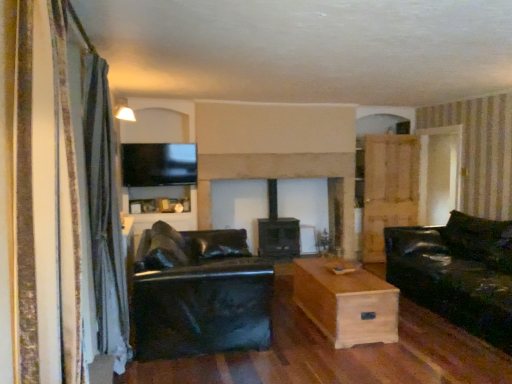
This screenshot has height=384, width=512. Identify the location of gray fabric curtain at left, which is counted as the 1th curtain, starting from the left. (104, 214).

In order to face light brown wood coffee table at center, should I rotate leftwards or rightwards?

It's best to rotate right around 10.959 degrees.

What is the approximate height of light brown wood coffee table at center?

It is 18.27 inches.

I want to click on light brown wood armoire at right, so click(388, 189).

Locate an element on the screen. The image size is (512, 384). gray fabric curtain at left, the 2th curtain positioned from the front is located at coordinates (104, 214).

In the scene shown: How many degrees apart are the facing directions of matte black tv at upper left and black leather couch at right, marked as the 1th studio couch in a right-to-left arrangement?

matte black tv at upper left and black leather couch at right, marked as the 1th studio couch in a right-to-left arrangement, are facing 91.7 degrees away from each other.

Who is smaller, matte black tv at upper left or black leather couch at right, marked as the 1th studio couch in a right-to-left arrangement?

With smaller size is matte black tv at upper left.

From a real-world perspective, is matte black tv at upper left positioned above or below black leather couch at right, marked as the 2th studio couch in a left-to-right arrangement?

matte black tv at upper left is above black leather couch at right, marked as the 2th studio couch in a left-to-right arrangement.

Find the location of a particular element. the 1st studio couch below the matte black tv at upper left (from the image's perspective) is located at coordinates (457, 272).

Considering the points (176, 186) and (99, 236), which point is in front, point (176, 186) or point (99, 236)?

Point (99, 236)

From a real-world perspective, is matte black tv at upper left under gray fabric curtain at left, which appears as the second curtain when viewed from the right?

No, from a real-world perspective, matte black tv at upper left is not beneath gray fabric curtain at left, which appears as the second curtain when viewed from the right.

In the image, is matte black tv at upper left positioned in front of or behind gray fabric curtain at left, the 2th curtain positioned from the front?

matte black tv at upper left is positioned farther from the viewer than gray fabric curtain at left, the 2th curtain positioned from the front.

Which of these two, black leather couch at right, marked as the 2th studio couch in a left-to-right arrangement, or light brown wood coffee table at center, is smaller?

light brown wood coffee table at center is smaller.

Based on the photo, considering the sizes of objects black leather couch at right, marked as the 1th studio couch in a right-to-left arrangement, and light brown wood coffee table at center in the image provided, who is taller, black leather couch at right, marked as the 1th studio couch in a right-to-left arrangement, or light brown wood coffee table at center?

black leather couch at right, marked as the 1th studio couch in a right-to-left arrangement.

From a real-world perspective, does black leather couch at right, marked as the 2th studio couch in a left-to-right arrangement, stand above light brown wood coffee table at center?

Yes, from a real-world perspective, black leather couch at right, marked as the 2th studio couch in a left-to-right arrangement, is on top of light brown wood coffee table at center.

Where is `table below the black leather couch at right, marked as the 1th studio couch in a right-to-left arrangement (from a real-world perspective)`? table below the black leather couch at right, marked as the 1th studio couch in a right-to-left arrangement (from a real-world perspective) is located at coordinates (346, 303).

Considering the points (97, 179) and (481, 273), which point is behind, point (97, 179) or point (481, 273)?

The point (481, 273) is behind.

Is gray fabric curtain at left, the first curtain viewed from the back, facing towards black leather couch at right, marked as the 2th studio couch in a left-to-right arrangement?

Yes.

Is gray fabric curtain at left, which appears as the second curtain when viewed from the right, completely or partially outside of black leather couch at right, marked as the 2th studio couch in a left-to-right arrangement?

Yes, gray fabric curtain at left, which appears as the second curtain when viewed from the right, is located beyond the bounds of black leather couch at right, marked as the 2th studio couch in a left-to-right arrangement.

How many degrees apart are the facing directions of gray fabric curtain at left, which appears as the second curtain when viewed from the right, and black leather couch at right, marked as the 1th studio couch in a right-to-left arrangement?

179 degrees separate the facing orientations of gray fabric curtain at left, which appears as the second curtain when viewed from the right, and black leather couch at right, marked as the 1th studio couch in a right-to-left arrangement.

Is light brown wood armoire at right oriented away from black leather couch at center, acting as the 2th studio couch starting from the right?

light brown wood armoire at right is not turned away from black leather couch at center, acting as the 2th studio couch starting from the right.

In terms of width, does light brown wood armoire at right look wider or thinner when compared to black leather couch at center, acting as the 2th studio couch starting from the right?

In the image, light brown wood armoire at right appears to be more narrow than black leather couch at center, acting as the 2th studio couch starting from the right.

Can you confirm if light brown wood armoire at right is bigger than black leather couch at center, acting as the 2th studio couch starting from the right?

No.

Which of these two, light brown wood armoire at right or black leather couch at center, acting as the 2th studio couch starting from the right, stands taller?

light brown wood armoire at right is taller.

Relative to light brown wood armoire at right, is striped fabric curtain at left, positioned as the first curtain in right-to-left order, in front or behind?

striped fabric curtain at left, positioned as the first curtain in right-to-left order, is positioned closer to the viewer than light brown wood armoire at right.

From the image's perspective, is striped fabric curtain at left, positioned as the first curtain in right-to-left order, located above or below light brown wood armoire at right?

Clearly, from the image's perspective, striped fabric curtain at left, positioned as the first curtain in right-to-left order, is above light brown wood armoire at right.

This screenshot has height=384, width=512. What are the coordinates of `the 2nd curtain located above the light brown wood armoire at right (from a real-world perspective)` in the screenshot? It's located at (41, 195).

From a real-world perspective, is striped fabric curtain at left, positioned as the first curtain in right-to-left order, located higher than light brown wood armoire at right?

Yes.

From a real-world perspective, which is physically above, transparent glass door at upper right or light brown wood armoire at right?

In real-world perspective, transparent glass door at upper right is above.

Which is less distant, (458, 136) or (364, 198)?

Point (458, 136) appears to be closer to the viewer than point (364, 198).

Can you confirm if transparent glass door at upper right is bigger than light brown wood armoire at right?

Correct, transparent glass door at upper right is larger in size than light brown wood armoire at right.

The width and height of the screenshot is (512, 384). Find the location of `entertainment center above the black leather couch at right, marked as the 1th studio couch in a right-to-left arrangement (from a real-world perspective)`. entertainment center above the black leather couch at right, marked as the 1th studio couch in a right-to-left arrangement (from a real-world perspective) is located at coordinates (157, 174).

From the image's perspective, starting from the matte black tv at upper left, which curtain is the 2nd one below? Please provide its 2D coordinates.

[(104, 214)]

Based on their spatial positions, is light brown wood coffee table at center or transparent glass door at upper right closer to black leather couch at right, marked as the 2th studio couch in a left-to-right arrangement?

Based on the image, light brown wood coffee table at center appears to be nearer to black leather couch at right, marked as the 2th studio couch in a left-to-right arrangement.

Looking at the image, which one is located further to transparent glass door at upper right, matte black tv at upper left or black leather couch at right, marked as the 2th studio couch in a left-to-right arrangement?

Among the two, matte black tv at upper left is located further to transparent glass door at upper right.

From the image, which object appears to be nearer to light brown wood coffee table at center, transparent glass door at upper right or striped fabric curtain at left, which ranks as the second curtain in back-to-front order?

transparent glass door at upper right is closer to light brown wood coffee table at center.

Which object lies further to the anchor point black leather couch at center, acting as the 2th studio couch starting from the right, light brown wood coffee table at center or light brown wood armoire at right?

light brown wood armoire at right lies further to black leather couch at center, acting as the 2th studio couch starting from the right, than the other object.

Based on the photo, looking at the image, which one is located closer to matte black tv at upper left, light brown wood armoire at right or striped fabric curtain at left, which ranks as the second curtain in back-to-front order?

Among the two, light brown wood armoire at right is located nearer to matte black tv at upper left.

In the scene shown: From the image, which object appears to be farther from light brown wood coffee table at center, light brown wood armoire at right or gray fabric curtain at left, the first curtain viewed from the back?

light brown wood armoire at right lies further to light brown wood coffee table at center than the other object.

Based on their spatial positions, is black leather couch at right, marked as the 2th studio couch in a left-to-right arrangement, or matte black tv at upper left further from transparent glass door at upper right?

matte black tv at upper left is positioned further to the anchor transparent glass door at upper right.

When comparing their distances from gray fabric curtain at left, which is counted as the 1th curtain, starting from the left, does light brown wood armoire at right or light brown wood coffee table at center seem closer?

light brown wood coffee table at center is closer to gray fabric curtain at left, which is counted as the 1th curtain, starting from the left.

At what (x,y) coordinates should I click in order to perform the action: click on table between black leather couch at right, marked as the 2th studio couch in a left-to-right arrangement, and transparent glass door at upper right from front to back. Please return your answer as a coordinate pair (x, y). Looking at the image, I should click on (346, 303).

Find the location of a particular element. glass door between black leather couch at right, marked as the 2th studio couch in a left-to-right arrangement, and light brown wood armoire at right in the front-back direction is located at coordinates (439, 173).

The height and width of the screenshot is (384, 512). In order to click on glass door positioned between striped fabric curtain at left, placed as the 1th curtain when sorted from front to back, and matte black tv at upper left from near to far in this screenshot , I will do `click(439, 173)`.

Where is `curtain between striped fabric curtain at left, which ranks as the second curtain in back-to-front order, and light brown wood coffee table at center from front to back`? This screenshot has height=384, width=512. curtain between striped fabric curtain at left, which ranks as the second curtain in back-to-front order, and light brown wood coffee table at center from front to back is located at coordinates (104, 214).